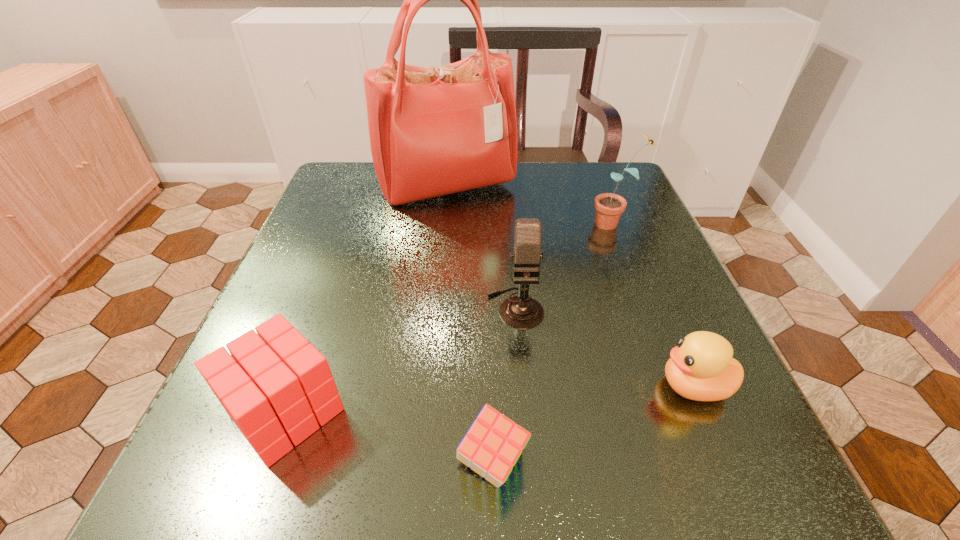
Where is `free space located on the flower of the sunflower`? The height and width of the screenshot is (540, 960). free space located on the flower of the sunflower is located at coordinates click(563, 223).

Locate an element on the screen. vacant area located on the front-facing side of the microphone is located at coordinates [x=531, y=489].

This screenshot has width=960, height=540. I want to click on free region located on the back of the taller cube, so click(x=324, y=308).

Find the location of a particular element. vacant space situated on the face of the duckling is located at coordinates (576, 386).

In order to click on free spot located on the face of the duckling in this screenshot , I will do `click(407, 386)`.

You are a GUI agent. You are given a task and a screenshot of the screen. Output one action in this format:
    pyautogui.click(x=<x>, y=<y>)
    Task: Click on the vacant space located 0.390m on the face of the duckling
    The height and width of the screenshot is (540, 960).
    Given the screenshot: What is the action you would take?
    pyautogui.click(x=393, y=386)

Find the location of a particular element. The width and height of the screenshot is (960, 540). free space located 0.250m on the left of the right cube is located at coordinates (261, 463).

Find the location of `object that is at the far edge`. object that is at the far edge is located at coordinates (433, 131).

Identify the location of handbag present at the left edge. (433, 131).

The width and height of the screenshot is (960, 540). Find the location of `cube that is positioned at the left edge`. cube that is positioned at the left edge is located at coordinates (275, 386).